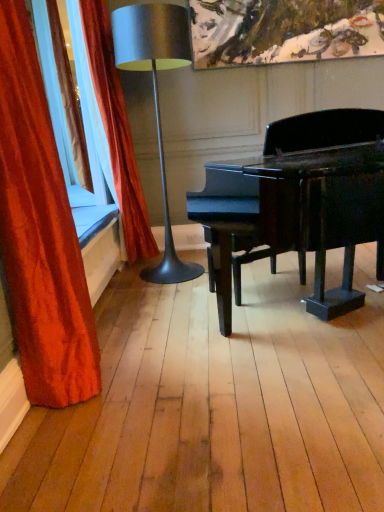
Question: Visually, is metallic silver lamp at left positioned to the left or to the right of velvet red curtain at left, the 1th curtain from the back?

Choices:
 (A) right
 (B) left

Answer: (A)

Question: Does point (124, 9) appear closer or farther from the camera than point (91, 49)?

Choices:
 (A) farther
 (B) closer

Answer: (B)

Question: Which is farther from the velvet red curtain at left, the second curtain viewed from the back?

Choices:
 (A) velvet red curtain at left, acting as the second curtain starting from the front
 (B) metallic silver lamp at left

Answer: (A)

Question: Estimate the real-world distances between objects in this image. Which object is farther from the metallic silver lamp at left?

Choices:
 (A) velvet red curtain at left, the second curtain viewed from the back
 (B) velvet red curtain at left, the 1th curtain from the back

Answer: (A)